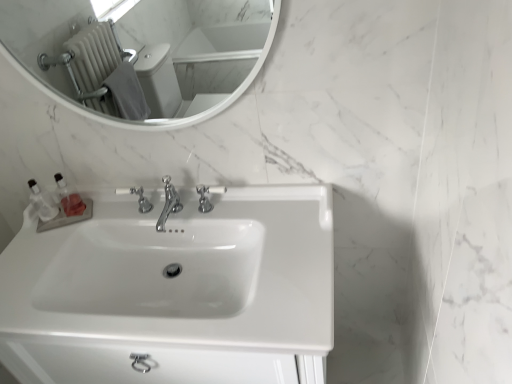
Question: Is point (35, 203) positioned closer to the camera than point (142, 210)?

Choices:
 (A) farther
 (B) closer

Answer: (A)

Question: From their relative heights in the image, would you say clear plastic bottles at left, which is the second toiletry in right-to-left order, is taller or shorter than chrome metallic faucet at center, acting as the first tap starting from the left?

Choices:
 (A) short
 (B) tall

Answer: (B)

Question: Estimate the real-world distances between objects in this image. Which object is farther from the chrome metallic faucet at center, acting as the first tap starting from the left?

Choices:
 (A) polished chrome faucet at center, positioned as the 1th tap in right-to-left order
 (B) clear plastic bottles at left, the 1th toiletry when ordered from right to left
 (C) polished chrome faucet at center, which appears as the second tap when viewed from the right
 (D) white glossy mirror at upper center
 (E) white glossy sink at center

Answer: (D)

Question: Which object is the farthest from the chrome metallic faucet at center, which is the 3th tap in right-to-left order?

Choices:
 (A) clear plastic bottles at left, the 1th toiletry when ordered from right to left
 (B) white glossy sink at center
 (C) polished chrome faucet at center, acting as the second tap starting from the left
 (D) white glossy mirror at upper center
 (E) polished chrome faucet at center, positioned as the 1th tap in right-to-left order

Answer: (D)